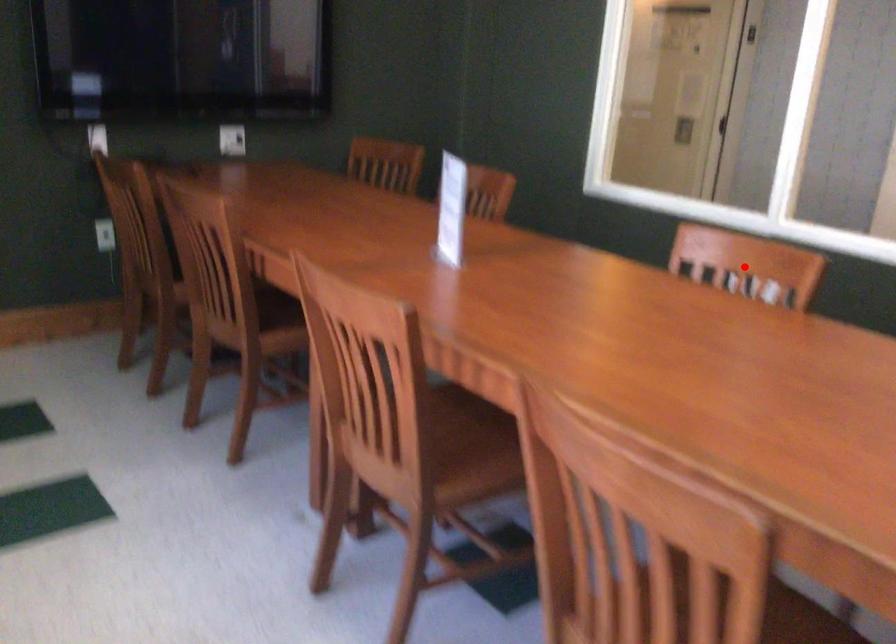
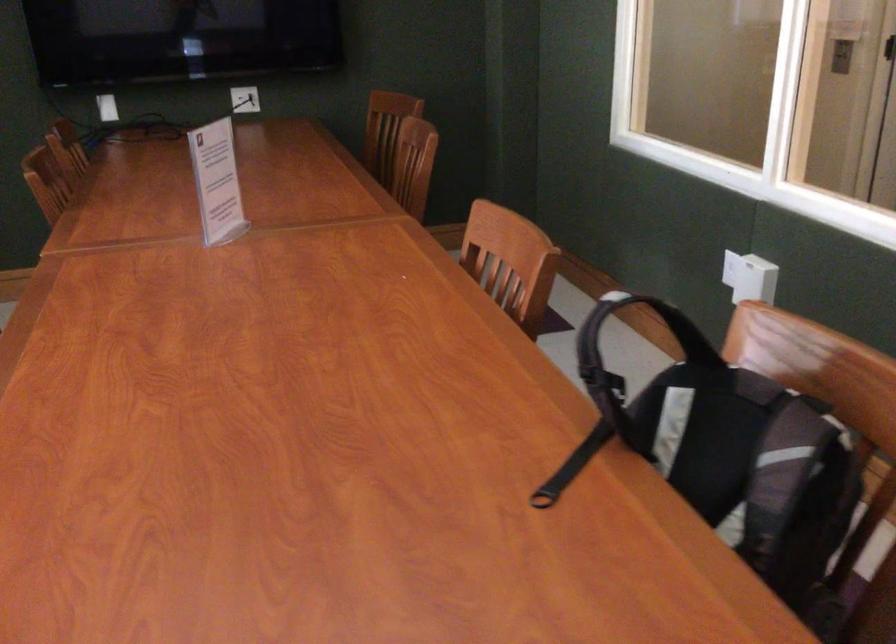
Question: I am providing you with two images of the same scene from different viewpoints. A red point is shown in image1. For the corresponding object point in image2, is it positioned nearer or farther from the camera?

Choices:
 (A) Nearer
 (B) Farther

Answer: (A)